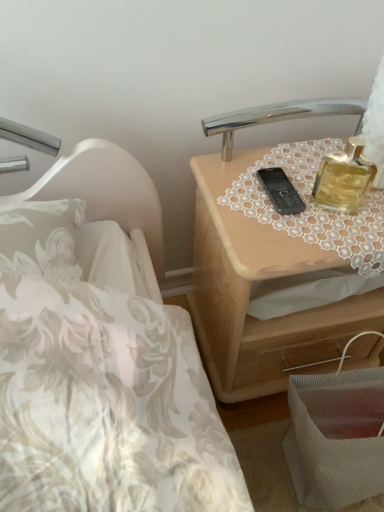
I want to click on vacant area to the left of gold glass perfume at upper right, so click(260, 204).